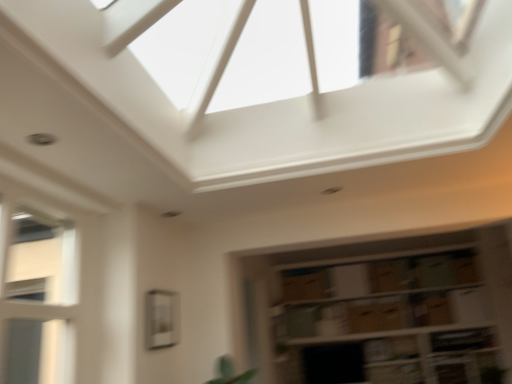
Question: Do you think white glass window at left, arranged as the first window when viewed from the left, is within clear glass window at center, the first window from the back, or outside of it?

Choices:
 (A) inside
 (B) outside

Answer: (B)

Question: Is white glass window at left, marked as the second window in a right-to-left arrangement, wider or thinner than clear glass window at center, marked as the second window in a front-to-back arrangement?

Choices:
 (A) thin
 (B) wide

Answer: (B)

Question: Based on their relative distances, which object is nearer to the brown cardboard boxes at lower right?

Choices:
 (A) clear glass window at center, the first window from the back
 (B) white glass window at left, which is counted as the 2th window, starting from the back

Answer: (A)

Question: Based on their relative distances, which object is farther from the clear glass window at center, which ranks as the first window in right-to-left order?

Choices:
 (A) white glass window at left, arranged as the first window when viewed from the left
 (B) brown cardboard boxes at lower right

Answer: (B)